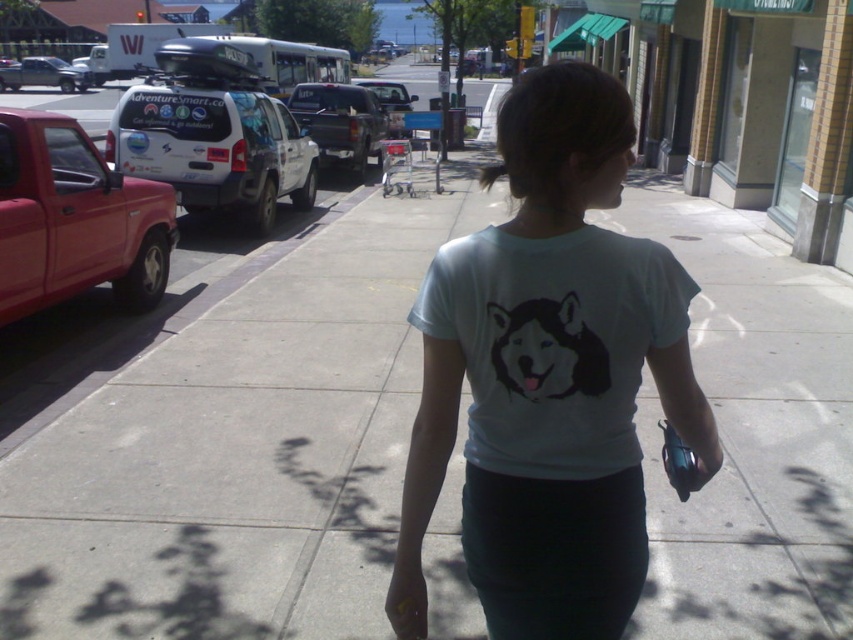
Question: Is the position of matte black truck at center less distant than that of matte black truck at left?

Choices:
 (A) yes
 (B) no

Answer: (A)

Question: Does light blue cotton t-shirt at center appear on the right side of matte black truck at center?

Choices:
 (A) no
 (B) yes

Answer: (B)

Question: Which point is farther to the camera?

Choices:
 (A) (563, 129)
 (B) (38, 65)
 (C) (196, 145)

Answer: (B)

Question: Is white matte suv at left below matte black truck at center?

Choices:
 (A) yes
 (B) no

Answer: (A)

Question: Which object appears closest to the camera in this image?

Choices:
 (A) matte black truck at left
 (B) white matte t-shirt at center
 (C) matte red truck at left

Answer: (B)

Question: Which of the following is the closest to the observer?

Choices:
 (A) (550, 397)
 (B) (332, 140)
 (C) (32, 266)

Answer: (A)